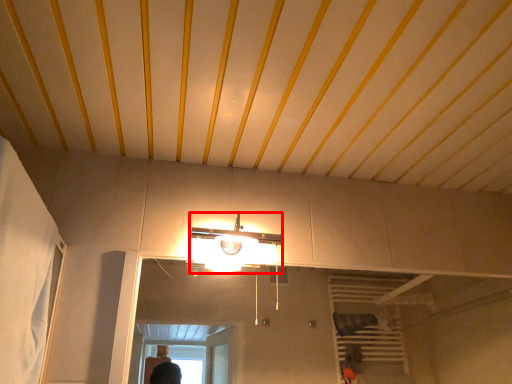
Question: From the image's perspective, what is the correct spatial positioning of light fixture (annotated by the red box) in reference to curtain?

Choices:
 (A) above
 (B) below

Answer: (B)